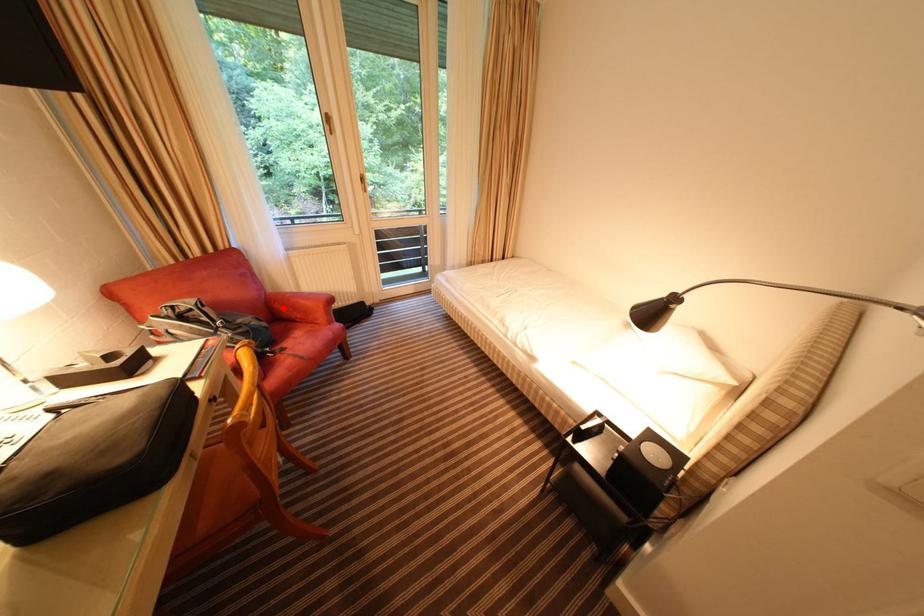
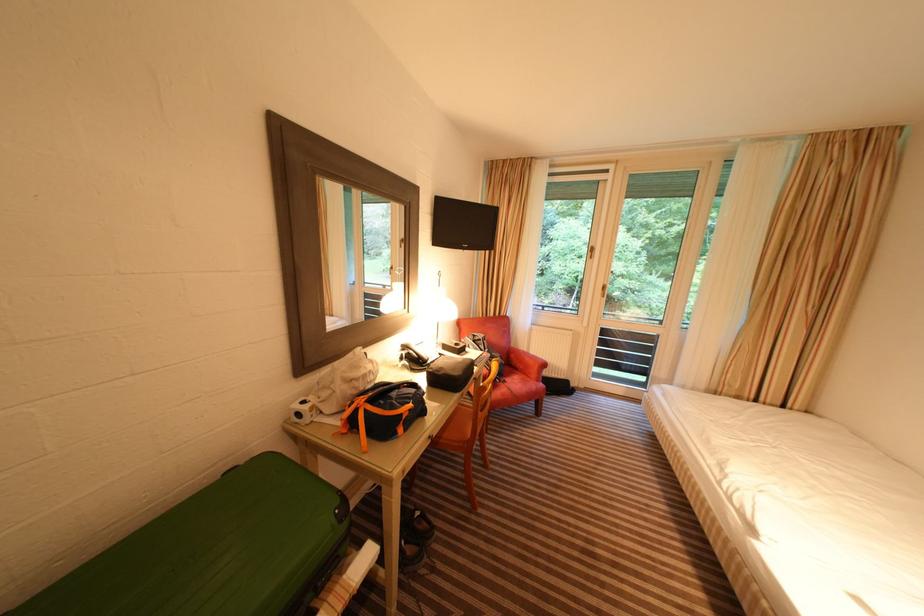
The point at the highlighted location is marked in the first image. Where is the corresponding point in the second image?

(518, 358)